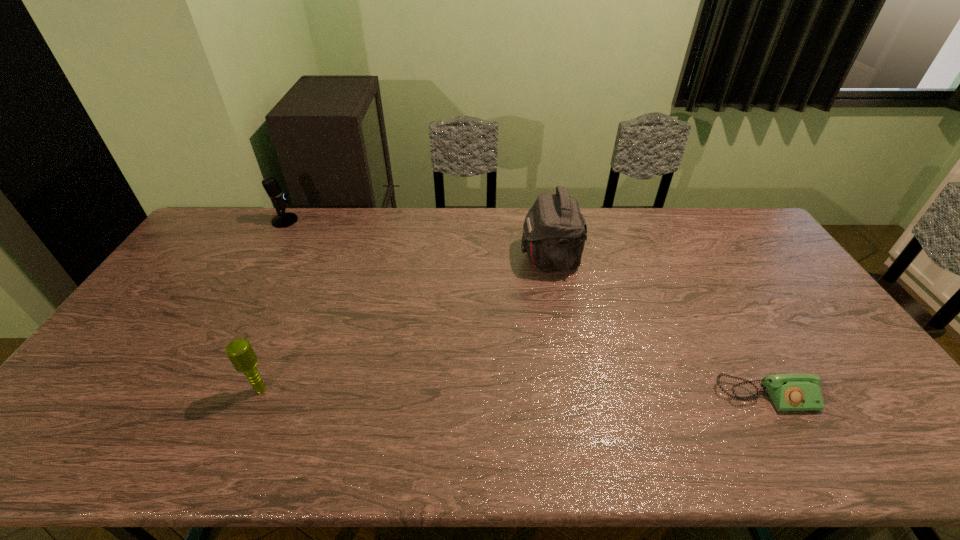
This screenshot has width=960, height=540. Find the location of `free space that is in between the farther microphone and the second object from left to right`. free space that is in between the farther microphone and the second object from left to right is located at coordinates (273, 305).

At what (x,y) coordinates should I click in order to perform the action: click on vacant space that's between the shortest object and the third object from left to right. Please return your answer as a coordinate pair (x, y). The height and width of the screenshot is (540, 960). Looking at the image, I should click on (658, 327).

Find the location of a particular element. Image resolution: width=960 pixels, height=540 pixels. empty space between the telephone and the third object from left to right is located at coordinates [658, 327].

Locate an element on the screen. Image resolution: width=960 pixels, height=540 pixels. vacant area between the left microphone and the telephone is located at coordinates (525, 308).

At what (x,y) coordinates should I click in order to perform the action: click on free area in between the telephone and the third object from right to left. Please return your answer as a coordinate pair (x, y). The height and width of the screenshot is (540, 960). Looking at the image, I should click on (514, 393).

Locate an element on the screen. free spot between the tallest object and the left microphone is located at coordinates (418, 239).

Identify the location of vacant area that lies between the second object from left to right and the telephone. The height and width of the screenshot is (540, 960). (514, 393).

Identify the location of free space between the second object from right to left and the right microphone. (406, 323).

I want to click on vacant space in between the shoulder bag and the farthest object, so click(x=418, y=239).

The width and height of the screenshot is (960, 540). In order to click on object that ranks as the closest to the nearer microphone in this screenshot , I will do `click(283, 219)`.